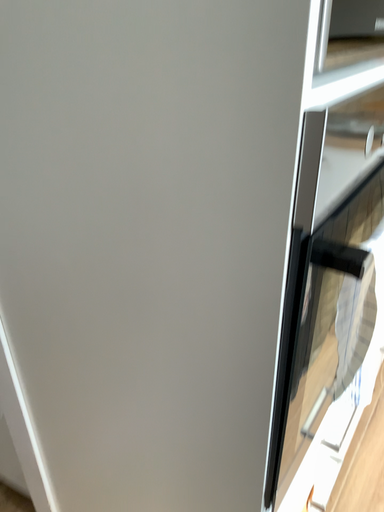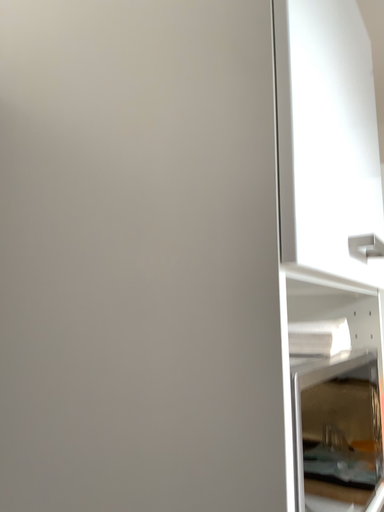
Question: Which way did the camera rotate in the video?

Choices:
 (A) rotated downward
 (B) rotated upward

Answer: (B)